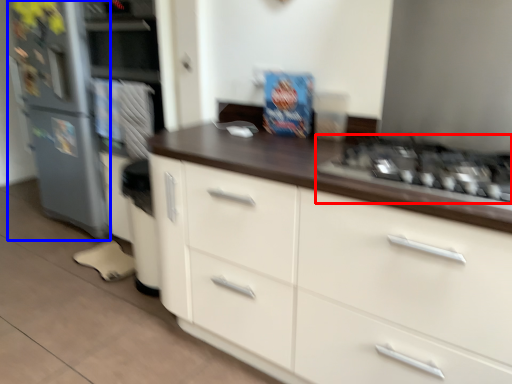
Question: Which object is closer to the camera taking this photo, gas stove (highlighted by a red box) or refrigerator (highlighted by a blue box)?

Choices:
 (A) gas stove
 (B) refrigerator

Answer: (A)